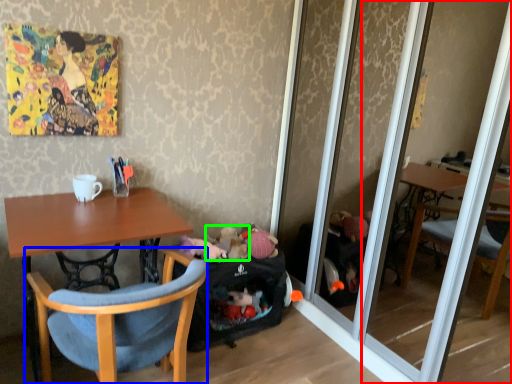
Question: Based on their relative distances, which object is nearer to mirror (highlighted by a red box)? Choose from chair (highlighted by a blue box) and toy (highlighted by a green box).

Choices:
 (A) chair
 (B) toy

Answer: (B)